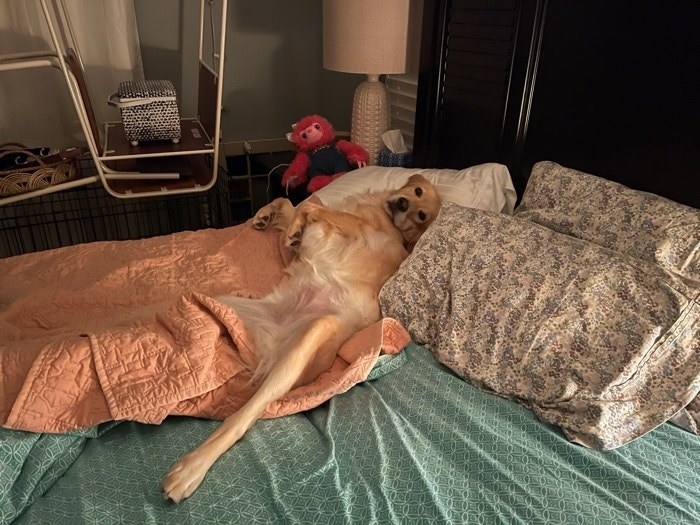
This screenshot has height=525, width=700. What are the coordinates of `light pink lamp shade` in the screenshot? It's located at (369, 29).